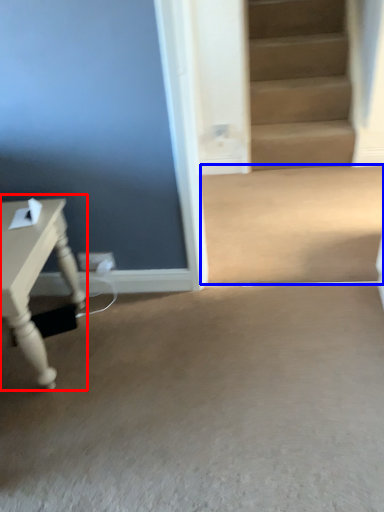
Question: Which point is further to the camera, table (highlighted by a red box) or concrete (highlighted by a blue box)?

Choices:
 (A) table
 (B) concrete

Answer: (B)